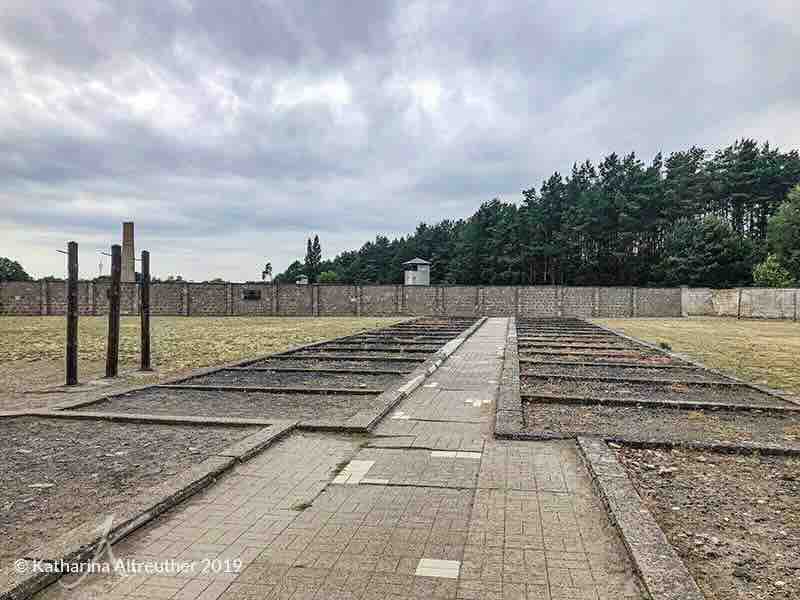
Locate an element on the screen. Image resolution: width=800 pixels, height=600 pixels. brick wall is located at coordinates (222, 294), (761, 300).